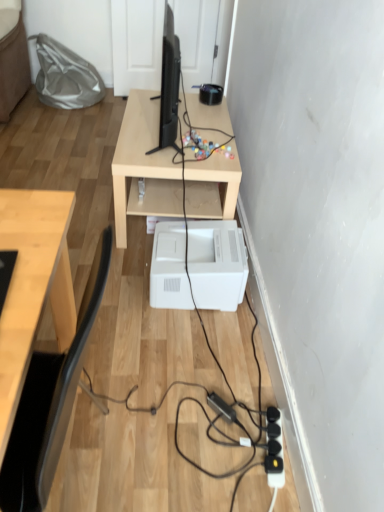
Question: From the image's perspective, would you say black matte desktop computer at center is shown under white plastic printer at lower center?

Choices:
 (A) no
 (B) yes

Answer: (A)

Question: Is black matte desktop computer at center far from white plastic printer at lower center?

Choices:
 (A) yes
 (B) no

Answer: (B)

Question: Considering the relative sizes of black matte desktop computer at center and white plastic printer at lower center in the image provided, is black matte desktop computer at center thinner than white plastic printer at lower center?

Choices:
 (A) no
 (B) yes

Answer: (B)

Question: Is black matte desktop computer at center outside white plastic printer at lower center?

Choices:
 (A) yes
 (B) no

Answer: (A)

Question: Can you confirm if black matte desktop computer at center is wider than white plastic printer at lower center?

Choices:
 (A) yes
 (B) no

Answer: (B)

Question: From the image's perspective, relative to black matte desktop computer at center, is black plastic extension cord at lower right above or below?

Choices:
 (A) above
 (B) below

Answer: (B)

Question: Considering their positions, is black plastic extension cord at lower right located in front of or behind black matte desktop computer at center?

Choices:
 (A) front
 (B) behind

Answer: (A)

Question: Is point (281, 444) closer or farther from the camera than point (167, 15)?

Choices:
 (A) closer
 (B) farther

Answer: (A)

Question: Is black plastic extension cord at lower right wider or thinner than black matte desktop computer at center?

Choices:
 (A) thin
 (B) wide

Answer: (A)

Question: In the image, is black matte desktop computer at center positioned in front of or behind white plastic printer at lower center?

Choices:
 (A) behind
 (B) front

Answer: (B)

Question: In terms of width, does black matte desktop computer at center look wider or thinner when compared to white plastic printer at lower center?

Choices:
 (A) wide
 (B) thin

Answer: (B)

Question: From the image's perspective, is black matte desktop computer at center located above or below white plastic printer at lower center?

Choices:
 (A) above
 (B) below

Answer: (A)

Question: From a real-world perspective, is black matte desktop computer at center positioned above or below white plastic printer at lower center?

Choices:
 (A) below
 (B) above

Answer: (B)

Question: Is black matte desktop computer at center wider or thinner than light wood table at center?

Choices:
 (A) thin
 (B) wide

Answer: (A)

Question: From the image's perspective, is black matte desktop computer at center positioned above or below light wood table at center?

Choices:
 (A) above
 (B) below

Answer: (A)